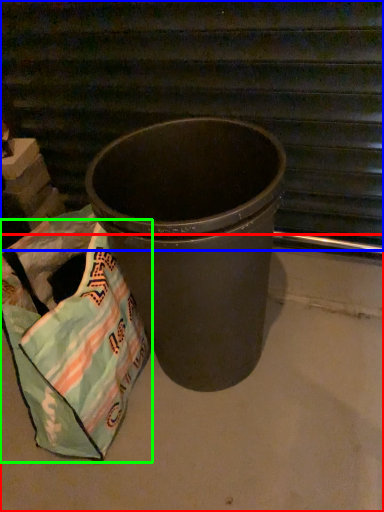
Question: Based on their relative distances, which object is farther from concrete (highlighted by a red box)? Choose from stairwell (highlighted by a blue box) and grocery bag (highlighted by a green box).

Choices:
 (A) stairwell
 (B) grocery bag

Answer: (A)